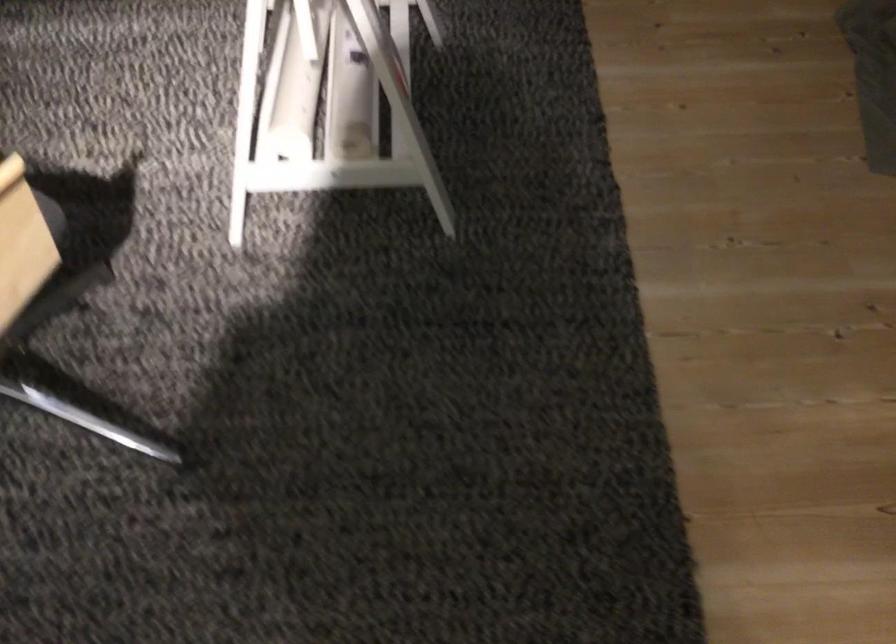
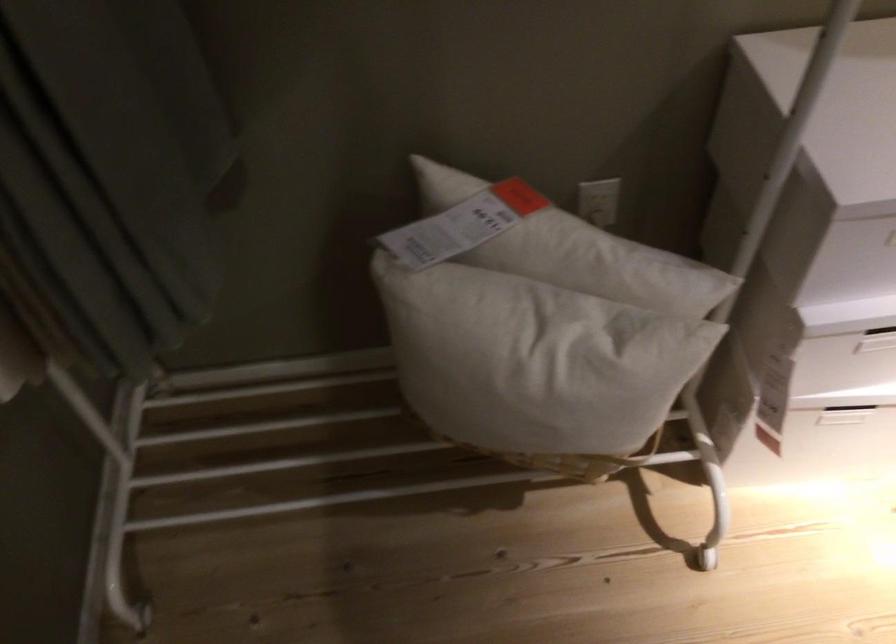
What movement of the cameraman would produce the second image?

The cameraman walked toward left, forward.